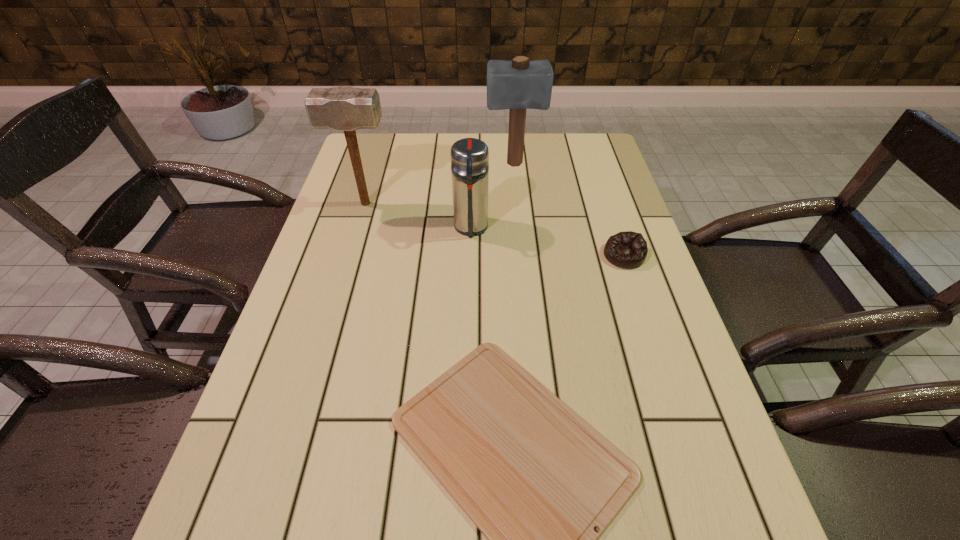
You are a GUI agent. You are given a task and a screenshot of the screen. Output one action in this format:
    pyautogui.click(x=<x>, y=<y>)
    Task: Click on the farthest object
    This screenshot has width=960, height=540.
    Given the screenshot: What is the action you would take?
    pyautogui.click(x=520, y=84)

Locate an element on the screen. This screenshot has width=960, height=540. the right mallet is located at coordinates (520, 84).

Locate an element on the screen. the fourth nearest object is located at coordinates (344, 108).

This screenshot has height=540, width=960. In order to click on the nearer mallet in this screenshot , I will do `click(344, 108)`.

I want to click on thermos bottle, so click(x=469, y=157).

Locate an element on the screen. beanbag is located at coordinates (628, 249).

At what (x,y) coordinates should I click in order to perform the action: click on the rightmost object. Please return your answer as a coordinate pair (x, y). Looking at the image, I should click on (628, 249).

Locate an element on the screen. vacant space located on the right of the right mallet is located at coordinates (605, 164).

Locate an element on the screen. free space located 0.270m on the striking face of the second farthest object is located at coordinates pos(490,204).

I want to click on vacant region located with a handle on the side of the third tallest object, so click(x=469, y=312).